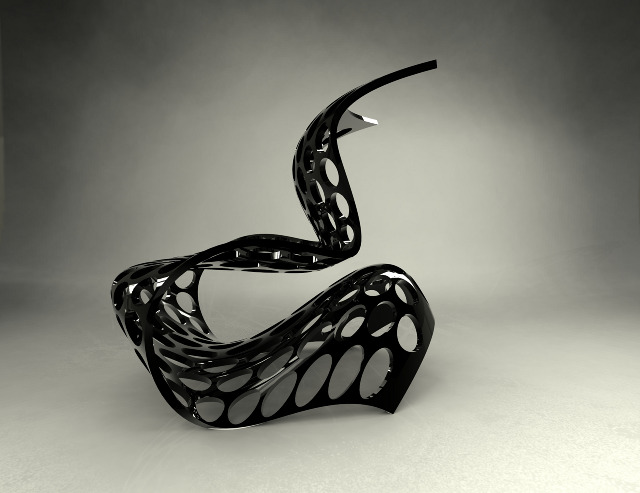
Image resolution: width=640 pixels, height=493 pixels. Identify the location of sharp corners of sculpture. [x=393, y=414], [x=379, y=122], [x=435, y=62].